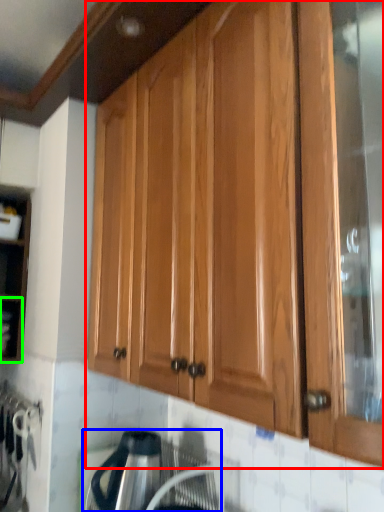
Question: Which object is positioned closest to cabinetry (highlighted by a red box)? Select from appliance (highlighted by a blue box) and shelf (highlighted by a green box).

Choices:
 (A) appliance
 (B) shelf

Answer: (A)